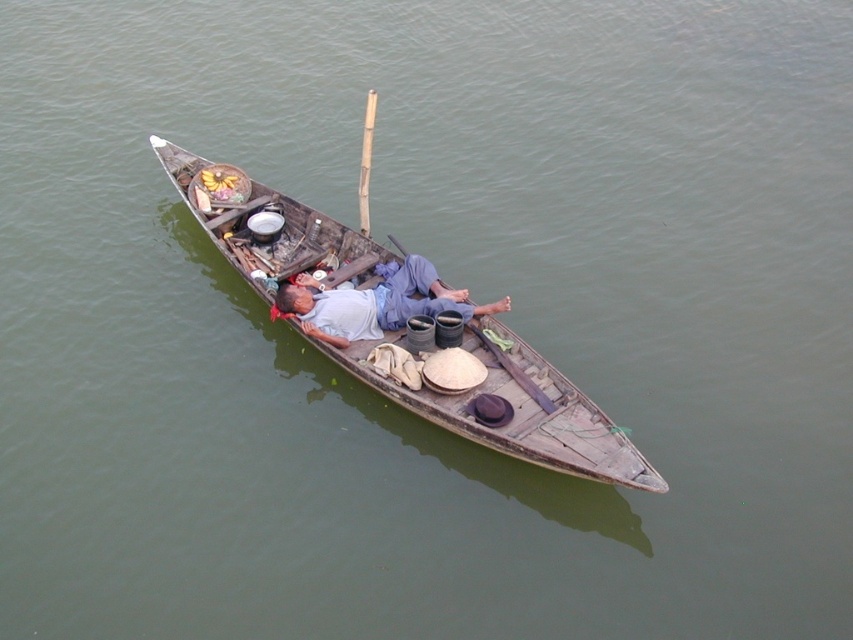
You are standing on the dock and want to locate the wooden boat at center. According to the coordinates provided, where should you look? Please specify the coordinates in the format of a point like point X,Y.

The wooden boat at center is located at point (515, 408).

You are standing on the shore and see the wooden boat at center and the gray fabric shirt at center. Which object is closer to you?

The wooden boat at center is closer to the viewer than the gray fabric shirt at center, so the wooden boat at center is closer to you.

You are standing on the dock and see the wooden boat at center and the gray fabric shirt at center in the image. Which object is positioned to the right of the other?

The wooden boat at center is to the right of the gray fabric shirt at center.